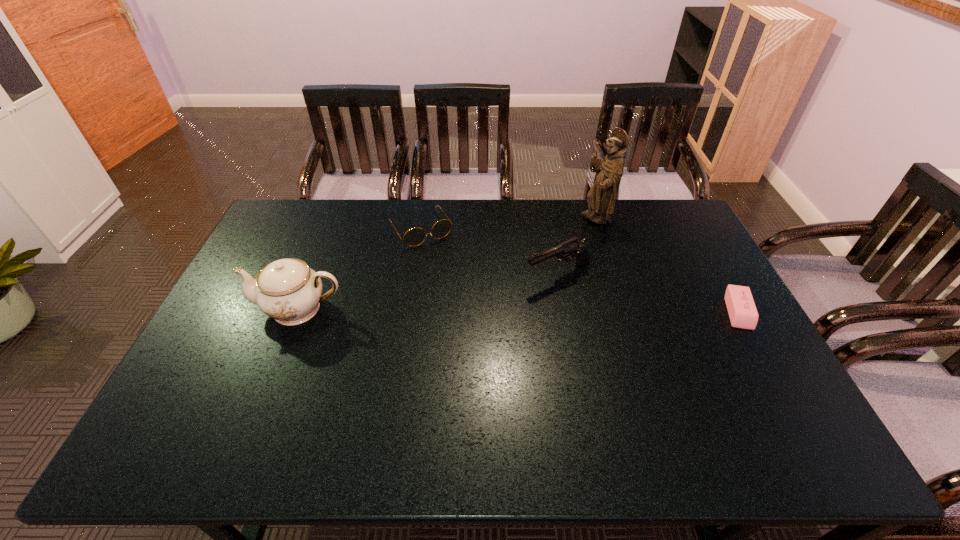
Identify which object is located as the third nearest to the gun. Please provide its 2D coordinates. Your answer should be formatted as a tuple, i.e. [(x, y)], where the tuple contains the x and y coordinates of a point satisfying the conditions above.

[(742, 311)]

I want to click on free space in the image that satisfies the following two spatial constraints: 1. on the back side of the fourth object from right to left; 2. on the left side of the figurine, so click(422, 219).